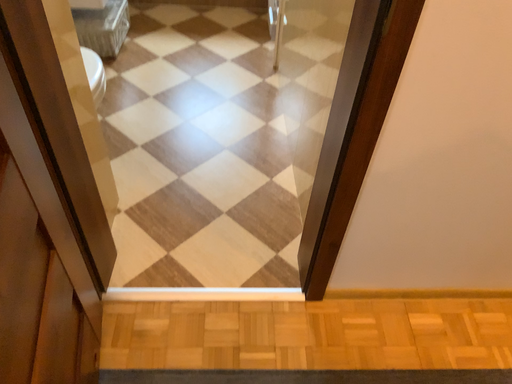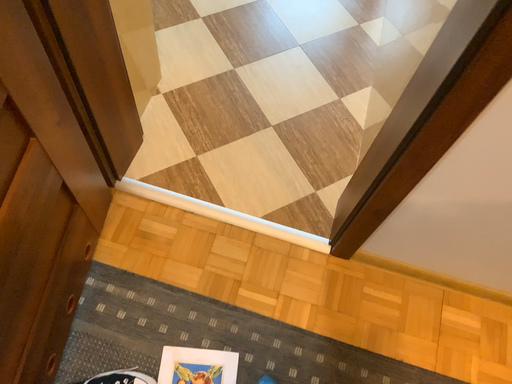
Question: Which way did the camera rotate in the video?

Choices:
 (A) rotated left
 (B) rotated right

Answer: (A)